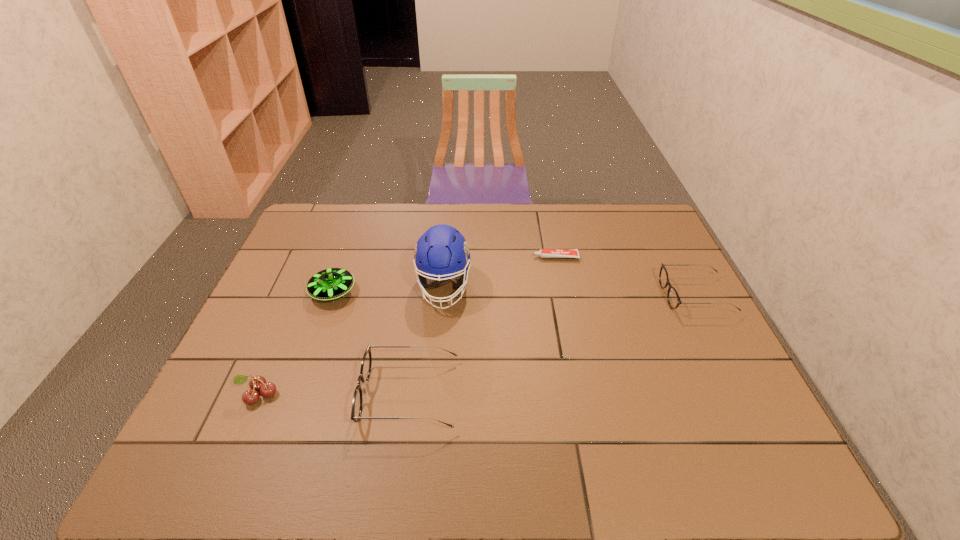
If equal spacing is desired by inserting an extra spectacles among them, please point out a free spot for this new spectacles. Please provide its 2D coordinates. Your answer should be formatted as a tuple, i.e. [(x, y)], where the tuple contains the x and y coordinates of a point satisfying the conditions above.

[(567, 340)]